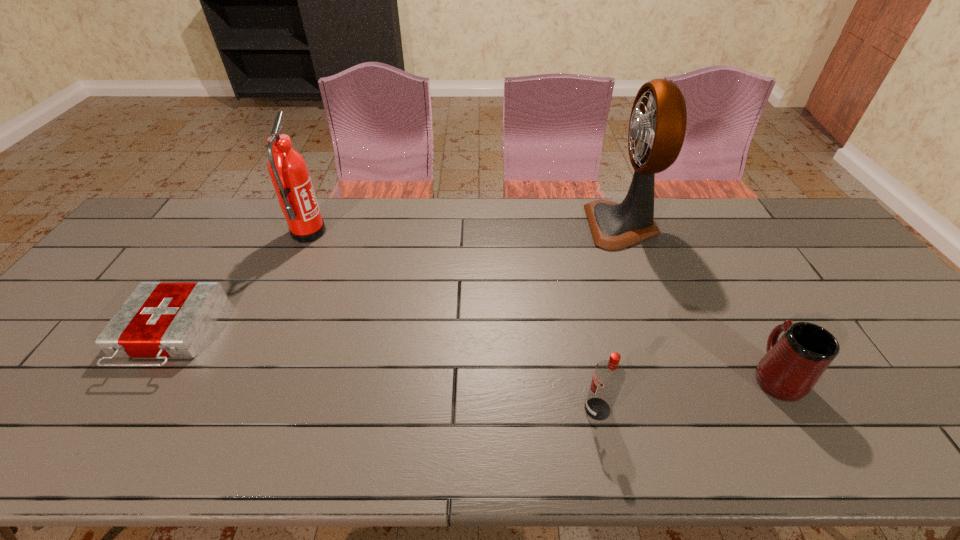
In order to click on vacant space situated on the front side of the leftmost object in this screenshot , I will do `click(107, 431)`.

What are the coordinates of `fan that is at the far edge` in the screenshot? It's located at (657, 127).

Identify the location of fire extinguisher that is at the far edge. This screenshot has width=960, height=540. (288, 171).

At what (x,y) coordinates should I click in order to perform the action: click on object that is at the near edge. Please return your answer as a coordinate pair (x, y). Image resolution: width=960 pixels, height=540 pixels. Looking at the image, I should click on (608, 377).

I want to click on vacant space at the far edge of the desktop, so click(744, 234).

Find the location of a particular element. This screenshot has height=540, width=960. free spot between the fan and the shortest object is located at coordinates (396, 280).

At what (x,y) coordinates should I click in order to perform the action: click on vacant area between the fan and the first-aid kit. Please return your answer as a coordinate pair (x, y). This screenshot has width=960, height=540. Looking at the image, I should click on pyautogui.click(x=396, y=280).

Locate an element on the screen. This screenshot has height=540, width=960. empty location between the third object from right to left and the fan is located at coordinates (610, 317).

Identify the location of free spot between the third object from left to right and the second shortest object. (686, 392).

This screenshot has height=540, width=960. Find the location of `vacant region between the leftmost object and the mug`. vacant region between the leftmost object and the mug is located at coordinates (471, 355).